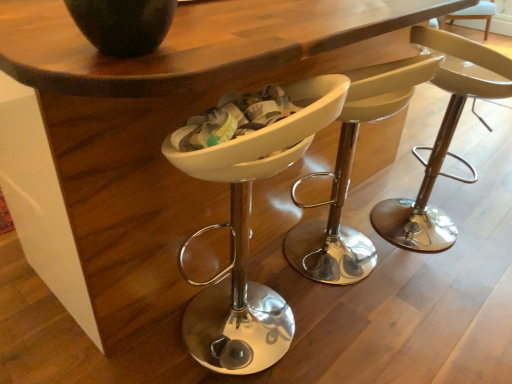
The height and width of the screenshot is (384, 512). I want to click on vacant space in front of white plastic chair at center, which is counted as the 2th chair, starting from the left, so click(377, 330).